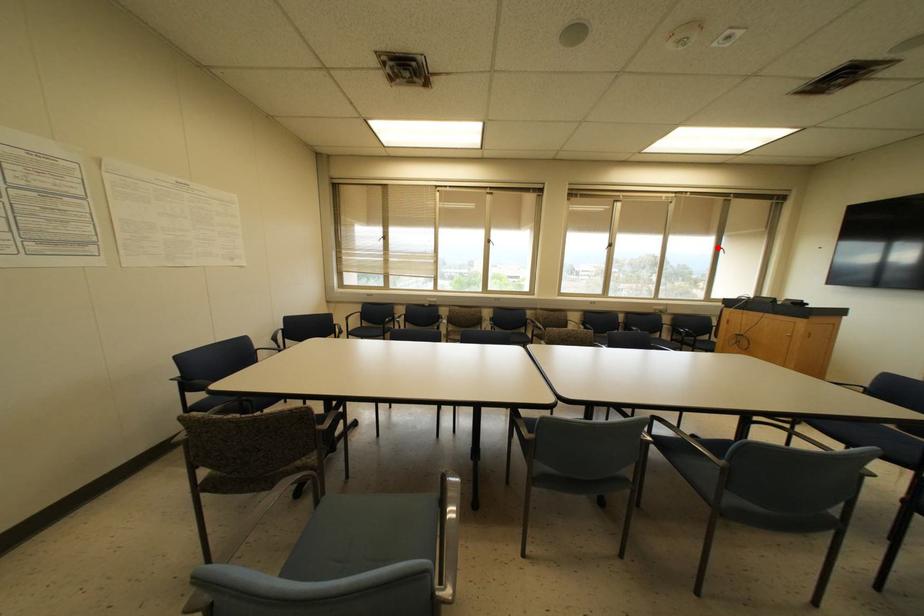
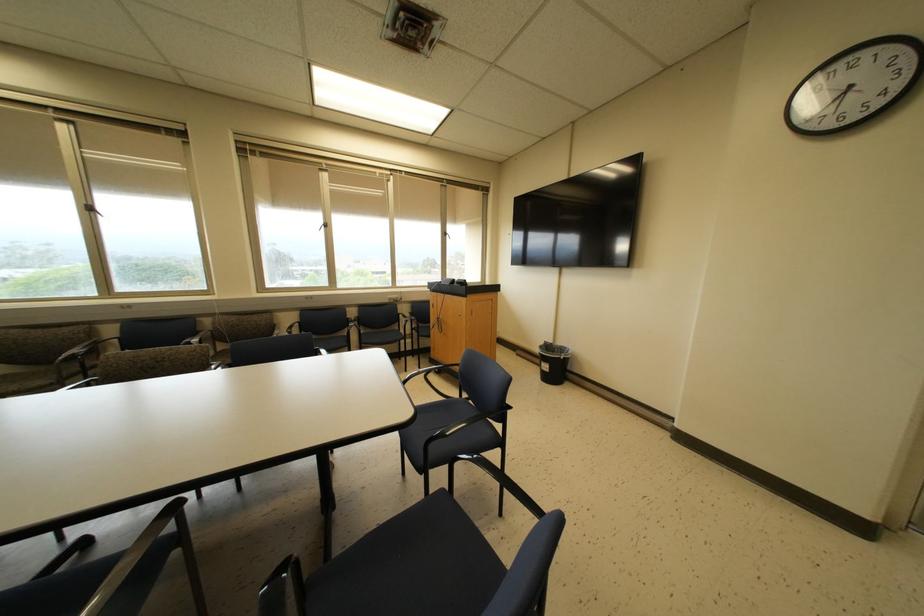
Question: I am providing you with two images of the same scene from different viewpoints. In image1, a red point is highlighted. Considering the same 3D point in image2, which of the following is correct?

Choices:
 (A) It is closer
 (B) It is farther

Answer: (A)